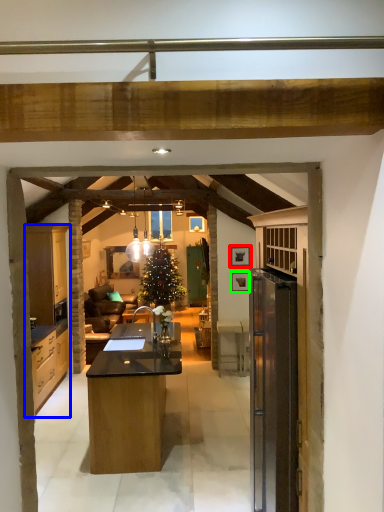
Question: Considering the real-world distances, which object is farthest from picture frame (highlighted by a red box)? cabinetry (highlighted by a blue box) or picture frame (highlighted by a green box)?

Choices:
 (A) cabinetry
 (B) picture frame

Answer: (A)